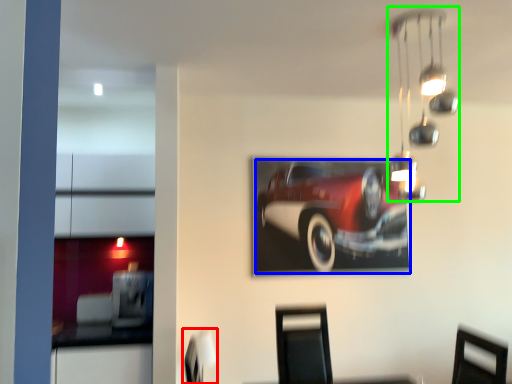
Question: Based on their relative distances, which object is nearer to swivel chair (highlighted by a red box)? Choose from car (highlighted by a blue box) and lamp (highlighted by a green box).

Choices:
 (A) car
 (B) lamp

Answer: (A)